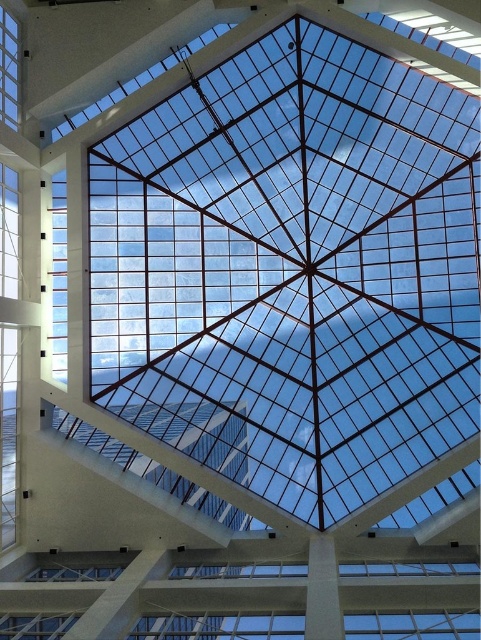
You are an architect designing a new building and want to ensure that the clear glass window at left and the transparent glass window at upper left meet specific height requirements. Based on the image, which window should you prioritize for height adjustments to comply with the requirement that the taller window must be at least twice as tall as the shorter one?

The clear glass window at left is much taller than the transparent glass window at upper left. Since the taller window must be at least twice as tall as the shorter one, you should prioritize adjusting the height of the transparent glass window at upper left to ensure the clear glass window at left meets the required proportion.

You are standing in the modern building and looking up at the transparent glass window at upper center. If you want to reach it with a 100 foot ladder, will the ladder be long enough?

The transparent glass window at upper center is 142.84 feet from viewer, so a 100 foot ladder will not be long enough to reach it.

You are an architect designing a new building and want to ensure that the transparent glass window at upper center and the transparent glass window at upper left are visible from the ground floor. Given their sizes, which window will allow more natural light into the space below?

The transparent glass window at upper center is bigger than the transparent glass window at upper left, so it will allow more natural light into the space below.